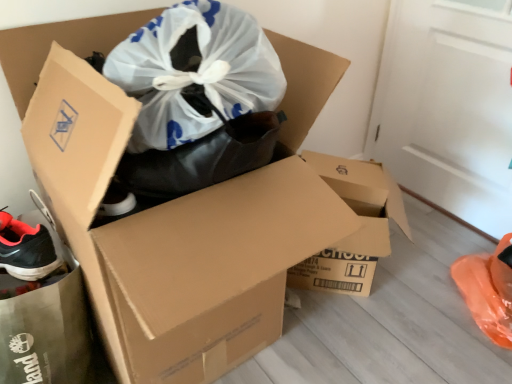
This screenshot has height=384, width=512. I want to click on vacant area situated below brown cardboard box at center, the 1th box viewed from the right (from a real-world perspective), so click(346, 298).